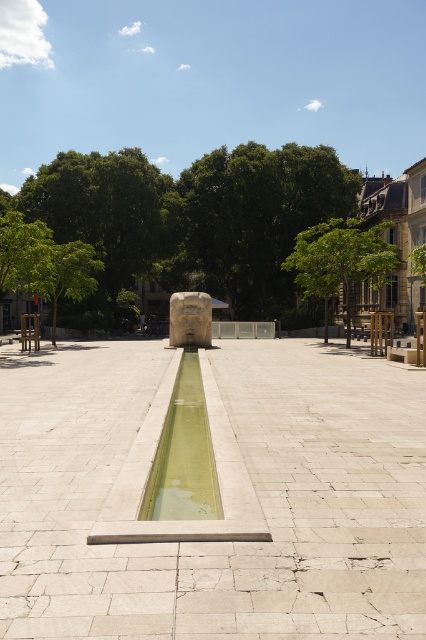
You are standing in the plaza and want to find shade. Which tree would provide more coverage? The green leafy tree at upper center or the green leafy tree at left?

The green leafy tree at upper center is much taller than the green leafy tree at left, so it likely provides more shade coverage.

You are planning to place a small bench in the plaza. The bench requires a space wider than the green concrete water at center but narrower than the green leafy tree at upper right. Is there enough space available in the plaza for the bench?

The green concrete water at center is narrower than the green leafy tree at upper right. Therefore, there is a space available between their widths where the bench can be placed.

Consider the image. You are planning to install a bench between the green leafy tree at upper right and the green leafy tree at left for people to rest. The bench requires at least 3 meters of space to fit comfortably. Can you place the bench between them?

The green leafy tree at upper right and green leafy tree at left are 11.63 meters apart from each other, so yes, you can place the bench between them as the distance is more than sufficient to accommodate the required 3 meters of space.